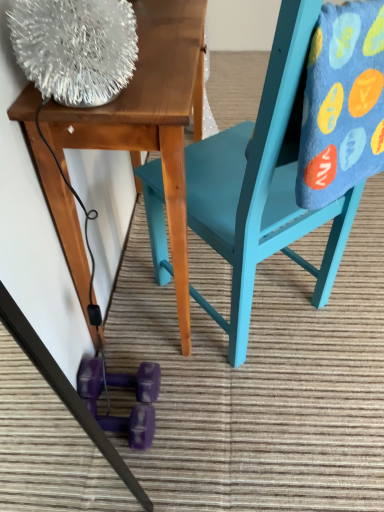
I want to click on unoccupied region to the right of purple rubber dumbbell at lower center, so click(193, 388).